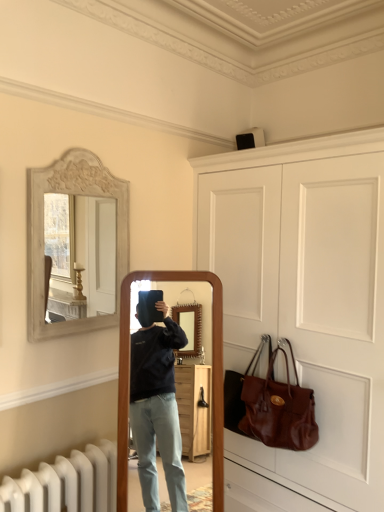
Question: Visually, is brown leather handbag at lower right positioned to the left or to the right of white matte door at upper center?

Choices:
 (A) right
 (B) left

Answer: (B)

Question: From a real-world perspective, is brown leather handbag at lower right above or below white matte door at upper center?

Choices:
 (A) above
 (B) below

Answer: (B)

Question: Estimate the real-world distances between objects in this image. Which object is farther from the white matte door at upper center?

Choices:
 (A) brown leather handbag at lower right
 (B) white carved wood mirror at upper left

Answer: (B)

Question: Estimate the real-world distances between objects in this image. Which object is closer to the white matte door at upper center?

Choices:
 (A) brown leather handbag at lower right
 (B) white carved wood mirror at upper left

Answer: (A)